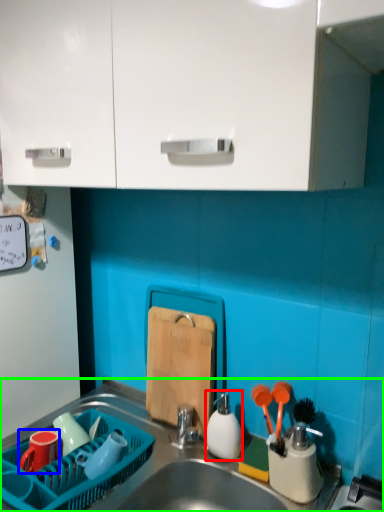
Question: Which is nearer to the tableware (highlighted by a red box)? tableware (highlighted by a blue box) or sink (highlighted by a green box).

Choices:
 (A) tableware
 (B) sink

Answer: (B)